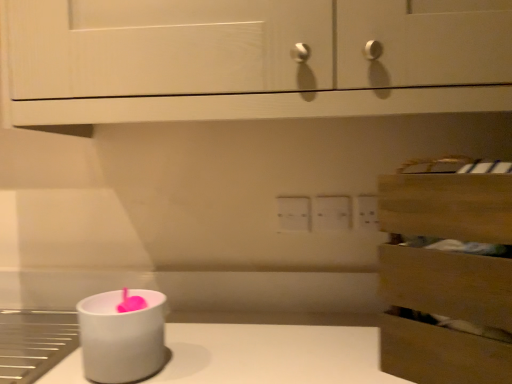
Question: Is white matte candle holder at lower left oriented towards wooden drawer at right?

Choices:
 (A) no
 (B) yes

Answer: (A)

Question: Considering the relative sizes of white matte candle holder at lower left and wooden drawer at right in the image provided, is white matte candle holder at lower left thinner than wooden drawer at right?

Choices:
 (A) yes
 (B) no

Answer: (A)

Question: Does white matte candle holder at lower left have a lesser height compared to wooden drawer at right?

Choices:
 (A) no
 (B) yes

Answer: (B)

Question: From the image's perspective, is white matte candle holder at lower left below wooden drawer at right?

Choices:
 (A) yes
 (B) no

Answer: (A)

Question: Is white matte candle holder at lower left wider than wooden drawer at right?

Choices:
 (A) no
 (B) yes

Answer: (A)

Question: Is white matte candle holder at lower left touching wooden drawer at right?

Choices:
 (A) no
 (B) yes

Answer: (A)

Question: Can you confirm if white wood cabinet at upper center is bigger than white matte candle holder at lower left?

Choices:
 (A) no
 (B) yes

Answer: (B)

Question: Is white wood cabinet at upper center to the right of white matte candle holder at lower left from the viewer's perspective?

Choices:
 (A) no
 (B) yes

Answer: (B)

Question: Is white wood cabinet at upper center outside white matte candle holder at lower left?

Choices:
 (A) yes
 (B) no

Answer: (A)

Question: Could white matte candle holder at lower left be considered to be inside white wood cabinet at upper center?

Choices:
 (A) yes
 (B) no

Answer: (B)

Question: Is white wood cabinet at upper center further to camera compared to white matte candle holder at lower left?

Choices:
 (A) yes
 (B) no

Answer: (B)

Question: Does white wood cabinet at upper center have a smaller size compared to white matte candle holder at lower left?

Choices:
 (A) no
 (B) yes

Answer: (A)

Question: Is white wood cabinet at upper center completely or partially outside of wooden drawer at right?

Choices:
 (A) no
 (B) yes

Answer: (B)